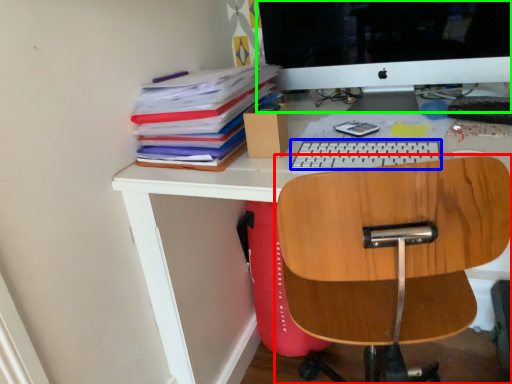
Question: Based on their relative distances, which object is farther from chair (highlighted by a red box)? Choose from keyboard (highlighted by a blue box) and computer monitor (highlighted by a green box).

Choices:
 (A) keyboard
 (B) computer monitor

Answer: (B)